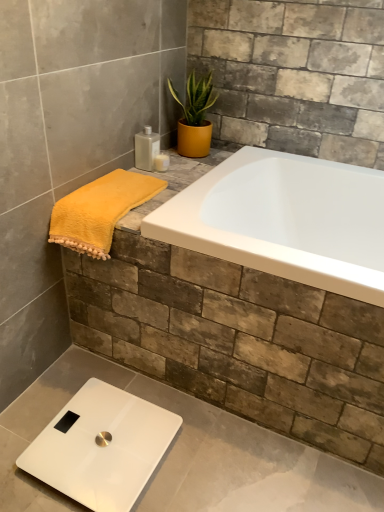
Question: Could you tell me if white glossy scale at lower left is facing yellow fluffy towel at left?

Choices:
 (A) yes
 (B) no

Answer: (B)

Question: From a real-world perspective, is white glossy scale at lower left positioned under yellow fluffy towel at left based on gravity?

Choices:
 (A) yes
 (B) no

Answer: (A)

Question: Is white glossy scale at lower left closer to the viewer compared to yellow fluffy towel at left?

Choices:
 (A) no
 (B) yes

Answer: (B)

Question: Does white glossy scale at lower left have a larger size compared to yellow fluffy towel at left?

Choices:
 (A) no
 (B) yes

Answer: (A)

Question: Is white glossy scale at lower left further to camera compared to yellow fluffy towel at left?

Choices:
 (A) yes
 (B) no

Answer: (B)

Question: From a real-world perspective, relative to yellow fluffy towel at left, is white glossy scale at lower left vertically above or below?

Choices:
 (A) above
 (B) below

Answer: (B)

Question: From the image's perspective, relative to yellow fluffy towel at left, is white glossy scale at lower left above or below?

Choices:
 (A) below
 (B) above

Answer: (A)

Question: Based on their sizes in the image, would you say white glossy scale at lower left is bigger or smaller than yellow fluffy towel at left?

Choices:
 (A) big
 (B) small

Answer: (B)

Question: Is white glossy scale at lower left inside the boundaries of yellow fluffy towel at left, or outside?

Choices:
 (A) outside
 (B) inside

Answer: (A)

Question: From the image's perspective, is yellow fluffy towel at left above or below translucent plastic soap dispenser at upper center, placed as the 1th toiletry when sorted from right to left?

Choices:
 (A) above
 (B) below

Answer: (B)

Question: Based on their positions, is yellow fluffy towel at left located to the left or right of translucent plastic soap dispenser at upper center, which is the 2th toiletry in left-to-right order?

Choices:
 (A) left
 (B) right

Answer: (A)

Question: Considering the positions of yellow fluffy towel at left and translucent plastic soap dispenser at upper center, placed as the 1th toiletry when sorted from right to left, in the image, is yellow fluffy towel at left wider or thinner than translucent plastic soap dispenser at upper center, placed as the 1th toiletry when sorted from right to left,?

Choices:
 (A) wide
 (B) thin

Answer: (A)

Question: Is yellow fluffy towel at left in front of or behind translucent plastic soap dispenser at upper center, placed as the 1th toiletry when sorted from right to left, in the image?

Choices:
 (A) behind
 (B) front

Answer: (B)

Question: Based on their positions, is white glossy scale at lower left located to the left or right of matte yellow pot at upper center?

Choices:
 (A) left
 (B) right

Answer: (A)

Question: Based on their sizes in the image, would you say white glossy scale at lower left is bigger or smaller than matte yellow pot at upper center?

Choices:
 (A) big
 (B) small

Answer: (B)